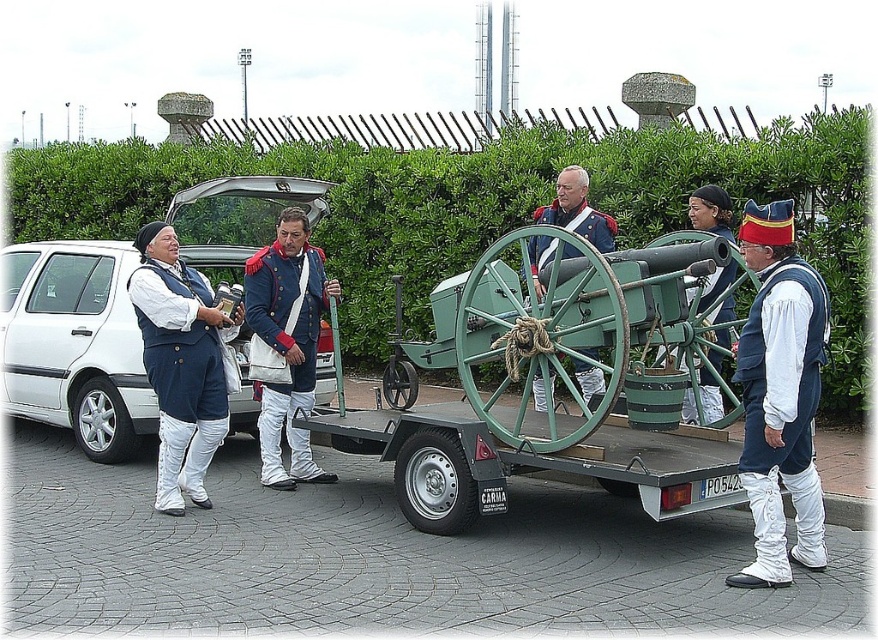
Is green leafy hedge at upper center positioned at the back of matte blue vest at left?

Yes.

Does green leafy hedge at upper center appear under matte blue vest at left?

No, green leafy hedge at upper center is not below matte blue vest at left.

Find the location of `green leafy hedge at upper center`. green leafy hedge at upper center is located at coordinates (491, 205).

Can you confirm if green leafy hedge at upper center is wider than blue woolen coat at center?

Indeed, green leafy hedge at upper center has a greater width compared to blue woolen coat at center.

Is green leafy hedge at upper center to the right of blue woolen coat at center from the viewer's perspective?

Indeed, green leafy hedge at upper center is positioned on the right side of blue woolen coat at center.

Is point (854, 356) positioned after point (326, 481)?

Yes, it is.

Where is `green leafy hedge at upper center`? The width and height of the screenshot is (878, 640). green leafy hedge at upper center is located at coordinates (491, 205).

Is green wooden cart at center further to the viewer compared to blue fabric uniform at center?

That is False.

Is point (439, 490) positioned after point (591, 392)?

No, it is not.

This screenshot has width=878, height=640. What do you see at coordinates (552, 390) in the screenshot?
I see `green wooden cart at center` at bounding box center [552, 390].

The width and height of the screenshot is (878, 640). In order to click on green wooden cart at center in this screenshot , I will do `click(552, 390)`.